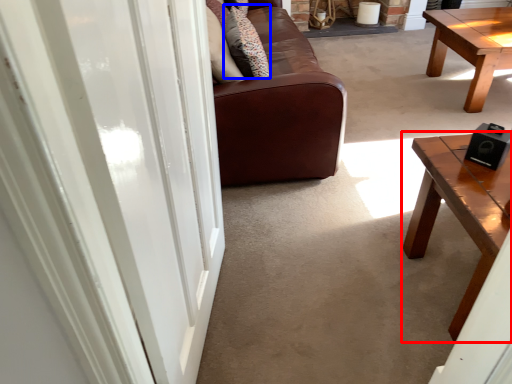
Question: Which of the following is the farthest to the observer, coffee table (highlighted by a red box) or pillow (highlighted by a blue box)?

Choices:
 (A) coffee table
 (B) pillow

Answer: (B)